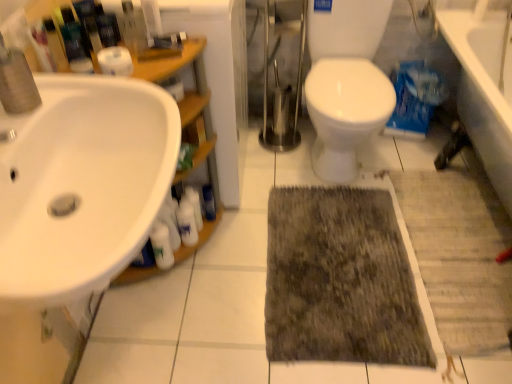
Where is `vacant area to the right of white glossy bottle at lower left, which is the first cleaning product from left to right`? The image size is (512, 384). vacant area to the right of white glossy bottle at lower left, which is the first cleaning product from left to right is located at coordinates (215, 274).